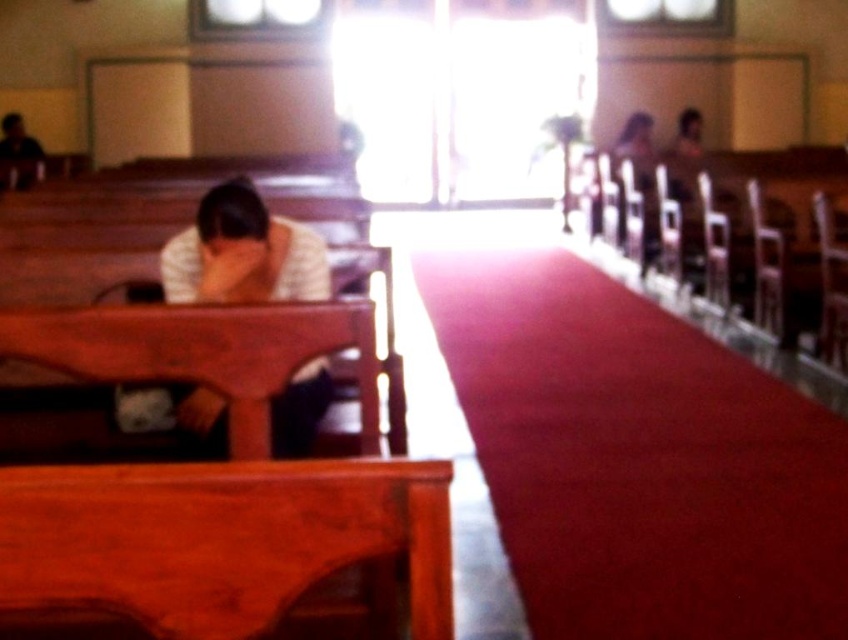
You are standing at the entrance of the church and want to approach the white matte shirt at left without stepping on the velvet red carpet at center. Is this possible?

The velvet red carpet at center is located below the white matte shirt at left, meaning the shirt is above the carpet. Since you are on the floor level, you can walk around the carpet or step beside it to reach the white matte shirt at left without stepping on the carpet.

You are standing at the entrance of the church and want to walk directly to the velvet red carpet at center. However, there is a person wearing a white matte shirt at left in your path. Can you walk straight ahead without stepping on the carpet or avoiding the person?

The velvet red carpet at center is in front of the white matte shirt at left, meaning the person is between you and the carpet. Therefore, you cannot walk straight ahead without encountering the person first.

Consider the image. You are a visitor entering the church and want to walk from the entrance to the altar. There is a velvet red carpet at center and a white matte shirt at left in your path. Which object will you encounter first as you walk towards the altar?

The velvet red carpet at center will be encountered first because it is positioned closer to the entrance along the path towards the altar compared to the white matte shirt at left, which is located to the side or off the direct path.